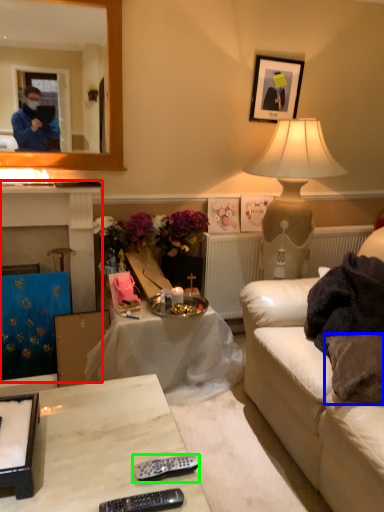
Question: Which object is the farthest from fireplace (highlighted by a red box)? Choose among these: pillow (highlighted by a blue box) or remote (highlighted by a green box).

Choices:
 (A) pillow
 (B) remote

Answer: (A)